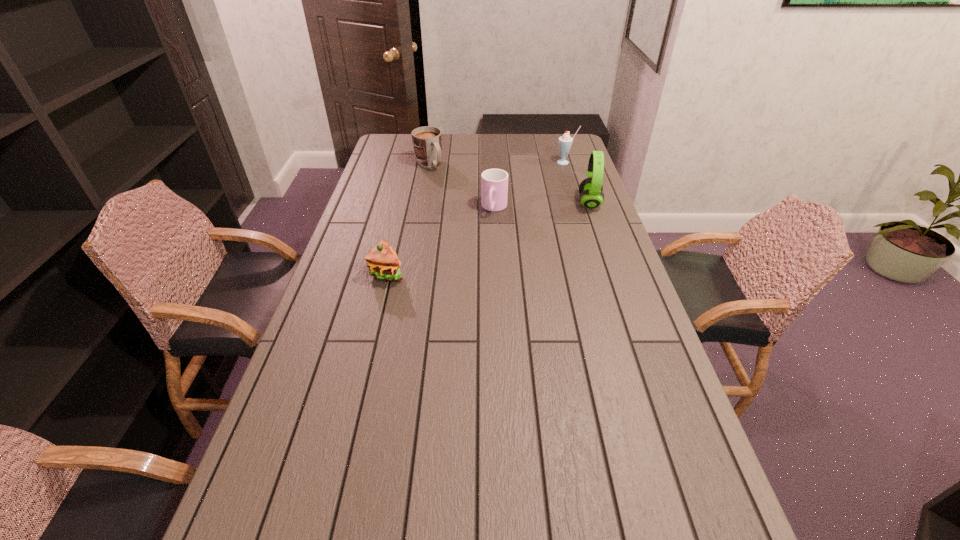
In the image, there is a desktop. At what (x,y) coordinates should I click in order to perform the action: click on free space at the far edge. Please return your answer as a coordinate pair (x, y). Looking at the image, I should click on (516, 143).

This screenshot has height=540, width=960. In order to click on blank space at the near edge in this screenshot , I will do `click(394, 478)`.

In the image, there is a desktop. Identify the location of free space at the left edge. The height and width of the screenshot is (540, 960). (348, 387).

The height and width of the screenshot is (540, 960). I want to click on vacant space at the right edge of the desktop, so click(616, 259).

Locate an element on the screen. Image resolution: width=960 pixels, height=540 pixels. free space at the near left corner of the desktop is located at coordinates (252, 495).

Identify the location of free space at the near right corner. (710, 485).

I want to click on free spot between the headset and the cup, so coord(541,206).

You are a GUI agent. You are given a task and a screenshot of the screen. Output one action in this format:
    pyautogui.click(x=<x>, y=<y>)
    Task: Click on the free space between the mug and the cup
    
    Given the screenshot: What is the action you would take?
    pyautogui.click(x=462, y=186)

Where is `free spot between the third object from left to right and the mug`? free spot between the third object from left to right and the mug is located at coordinates (462, 186).

Locate an element on the screen. vacant space that's between the cup and the headset is located at coordinates (541, 206).